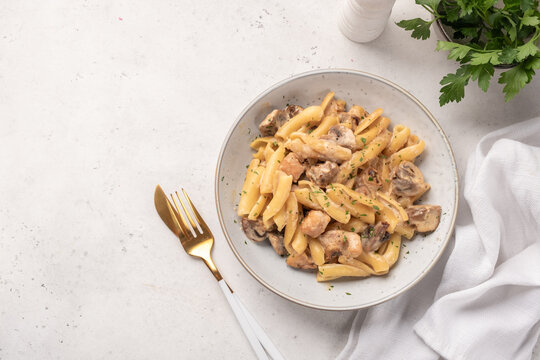
Locate an element on the screen. This screenshot has height=360, width=540. white table empty space is located at coordinates (480, 115), (359, 54), (212, 23), (52, 32), (189, 97), (69, 161), (54, 292), (165, 333), (297, 323).